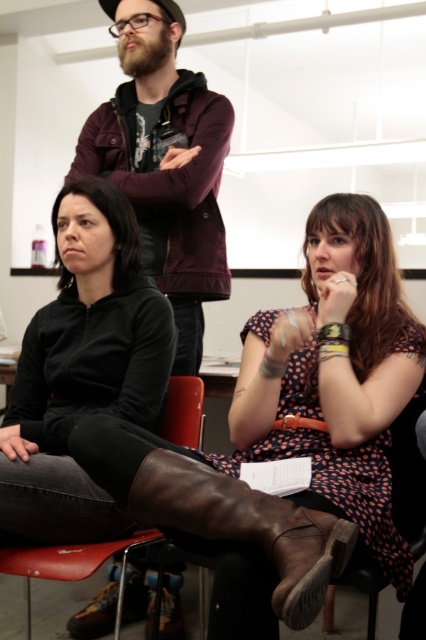
Is point (135, 513) closer to camera compared to point (423, 602)?

Yes, it is.

Who is taller, brown leather boot at lower center or brown leather chair at lower right?

brown leather chair at lower right is taller.

Between point (287, 586) and point (408, 508), which one is positioned in front?

Positioned in front is point (287, 586).

I want to click on brown leather boot at lower center, so click(247, 525).

Is maroon hoodie at upper center to the left of brown leather boot at lower center from the viewer's perspective?

Indeed, maroon hoodie at upper center is positioned on the left side of brown leather boot at lower center.

Between maroon hoodie at upper center and brown leather boot at lower center, which one is positioned higher?

maroon hoodie at upper center is above.

Describe the element at coordinates (164, 163) in the screenshot. I see `maroon hoodie at upper center` at that location.

Identify the location of maroon hoodie at upper center. This screenshot has height=640, width=426. (164, 163).

Is maroon hoodie at upper center shorter than brown leather chair at lower right?

No.

Does point (184, 116) lie in front of point (420, 637)?

That is False.

The height and width of the screenshot is (640, 426). I want to click on maroon hoodie at upper center, so click(164, 163).